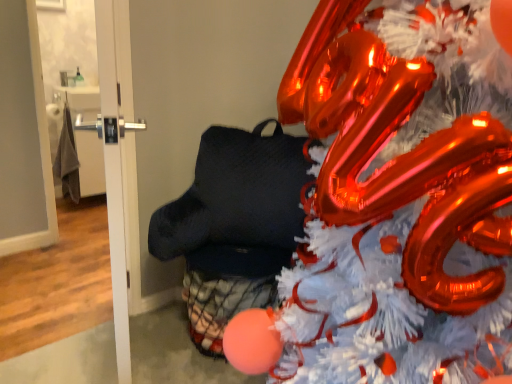
Where is `white glossy door at left, placed as the 2th door when sorted from left to right`? Image resolution: width=512 pixels, height=384 pixels. white glossy door at left, placed as the 2th door when sorted from left to right is located at coordinates (119, 165).

Find the location of `shiny metallic christmas tree at center`. shiny metallic christmas tree at center is located at coordinates (396, 202).

Which of these two, shiny metallic christmas tree at center or white glossy door at left, acting as the 1th door starting from the right, is wider?

shiny metallic christmas tree at center.

Is shiny metallic christmas tree at center bigger than white glossy door at left, acting as the 1th door starting from the right?

Yes, shiny metallic christmas tree at center is bigger than white glossy door at left, acting as the 1th door starting from the right.

From a real-world perspective, which is physically above, shiny metallic christmas tree at center or white glossy door at left, placed as the 2th door when sorted from left to right?

From a 3D spatial view, shiny metallic christmas tree at center is above.

Is shiny metallic christmas tree at center beside white glossy door at left, acting as the 1th door starting from the right?

No, shiny metallic christmas tree at center is not next to white glossy door at left, acting as the 1th door starting from the right.

Is shiny metallic christmas tree at center situated inside white glossy door at upper left, arranged as the second door when viewed from the right, or outside?

shiny metallic christmas tree at center is outside white glossy door at upper left, arranged as the second door when viewed from the right.

Who is bigger, shiny metallic christmas tree at center or white glossy door at upper left, arranged as the second door when viewed from the right?

Bigger between the two is shiny metallic christmas tree at center.

Is shiny metallic christmas tree at center facing away from white glossy door at upper left, arranged as the 1th door when viewed from the left?

That's not correct — shiny metallic christmas tree at center is not looking away from white glossy door at upper left, arranged as the 1th door when viewed from the left.

Does white glossy door at upper left, arranged as the 1th door when viewed from the left, have a lesser height compared to shiny metallic christmas tree at center?

Correct, white glossy door at upper left, arranged as the 1th door when viewed from the left, is not as tall as shiny metallic christmas tree at center.

Can you confirm if white glossy door at upper left, arranged as the 1th door when viewed from the left, is positioned to the left of shiny metallic christmas tree at center?

Yes.

Is shiny metallic christmas tree at center at the back of white glossy door at upper left, arranged as the second door when viewed from the right?

No, white glossy door at upper left, arranged as the second door when viewed from the right,'s orientation is not away from shiny metallic christmas tree at center.

From the image's perspective, is white glossy door at left, acting as the 1th door starting from the right, below white glossy door at upper left, arranged as the 1th door when viewed from the left?

Yes, from the image's perspective, white glossy door at left, acting as the 1th door starting from the right, is beneath white glossy door at upper left, arranged as the 1th door when viewed from the left.

Does white glossy door at left, acting as the 1th door starting from the right, lie in front of white glossy door at upper left, arranged as the 1th door when viewed from the left?

Yes, it is in front of white glossy door at upper left, arranged as the 1th door when viewed from the left.

Is white glossy door at upper left, arranged as the 1th door when viewed from the left, inside white glossy door at left, placed as the 2th door when sorted from left to right?

Actually, white glossy door at upper left, arranged as the 1th door when viewed from the left, is outside white glossy door at left, placed as the 2th door when sorted from left to right.

How far apart are white glossy door at left, acting as the 1th door starting from the right, and white glossy door at upper left, arranged as the second door when viewed from the right?

white glossy door at left, acting as the 1th door starting from the right, and white glossy door at upper left, arranged as the second door when viewed from the right, are 1.04 meters apart from each other.

Is the surface of white glossy door at upper left, arranged as the 1th door when viewed from the left, in direct contact with white glossy door at left, acting as the 1th door starting from the right?

No, white glossy door at upper left, arranged as the 1th door when viewed from the left, is not making contact with white glossy door at left, acting as the 1th door starting from the right.

Is white glossy door at upper left, arranged as the 1th door when viewed from the left, aimed at white glossy door at left, acting as the 1th door starting from the right?

Yes, white glossy door at upper left, arranged as the 1th door when viewed from the left, is turned towards white glossy door at left, acting as the 1th door starting from the right.

From their relative heights in the image, would you say white glossy door at upper left, arranged as the 1th door when viewed from the left, is taller or shorter than white glossy door at left, acting as the 1th door starting from the right?

In the image, white glossy door at upper left, arranged as the 1th door when viewed from the left, appears to be shorter than white glossy door at left, acting as the 1th door starting from the right.

Looking at their sizes, would you say white glossy door at left, placed as the 2th door when sorted from left to right, is wider or thinner than shiny metallic christmas tree at center?

Clearly, white glossy door at left, placed as the 2th door when sorted from left to right, has less width compared to shiny metallic christmas tree at center.

Is the position of white glossy door at left, placed as the 2th door when sorted from left to right, more distant than that of shiny metallic christmas tree at center?

Yes.

From a real-world perspective, is white glossy door at left, acting as the 1th door starting from the right, positioned over shiny metallic christmas tree at center based on gravity?

No, from a real-world perspective, white glossy door at left, acting as the 1th door starting from the right, is not over shiny metallic christmas tree at center

Image resolution: width=512 pixels, height=384 pixels. I want to click on christmas tree that is above the white glossy door at left, placed as the 2th door when sorted from left to right (from a real-world perspective), so click(396, 202).

Find the location of a particular element. door that is the 2nd object to the left of the shiny metallic christmas tree at center, starting at the anchor is located at coordinates (118, 256).

Looking at the image, which one is located further to white glossy door at upper left, arranged as the 1th door when viewed from the left, shiny metallic christmas tree at center or white glossy door at left, acting as the 1th door starting from the right?

Based on the image, shiny metallic christmas tree at center appears to be further to white glossy door at upper left, arranged as the 1th door when viewed from the left.

Considering their positions, is white glossy door at left, placed as the 2th door when sorted from left to right, positioned closer to white glossy door at upper left, arranged as the second door when viewed from the right, than shiny metallic christmas tree at center?

The object closer to white glossy door at upper left, arranged as the second door when viewed from the right, is white glossy door at left, placed as the 2th door when sorted from left to right.

Estimate the real-world distances between objects in this image. Which object is closer to white glossy door at left, acting as the 1th door starting from the right, shiny metallic christmas tree at center or white glossy door at upper left, arranged as the second door when viewed from the right?

Based on the image, shiny metallic christmas tree at center appears to be nearer to white glossy door at left, acting as the 1th door starting from the right.

Based on their spatial positions, is white glossy door at left, placed as the 2th door when sorted from left to right, or white glossy door at upper left, arranged as the 1th door when viewed from the left, closer to shiny metallic christmas tree at center?

white glossy door at left, placed as the 2th door when sorted from left to right, is positioned closer to the anchor shiny metallic christmas tree at center.

Based on their spatial positions, is white glossy door at upper left, arranged as the second door when viewed from the right, or shiny metallic christmas tree at center further from white glossy door at left, placed as the 2th door when sorted from left to right?

The object further to white glossy door at left, placed as the 2th door when sorted from left to right, is white glossy door at upper left, arranged as the second door when viewed from the right.

Which object lies nearer to the anchor point shiny metallic christmas tree at center, white glossy door at upper left, arranged as the second door when viewed from the right, or white glossy door at left, placed as the 2th door when sorted from left to right?

white glossy door at left, placed as the 2th door when sorted from left to right.

The height and width of the screenshot is (384, 512). What are the coordinates of `door between white glossy door at upper left, arranged as the second door when viewed from the right, and shiny metallic christmas tree at center` in the screenshot? It's located at (119, 165).